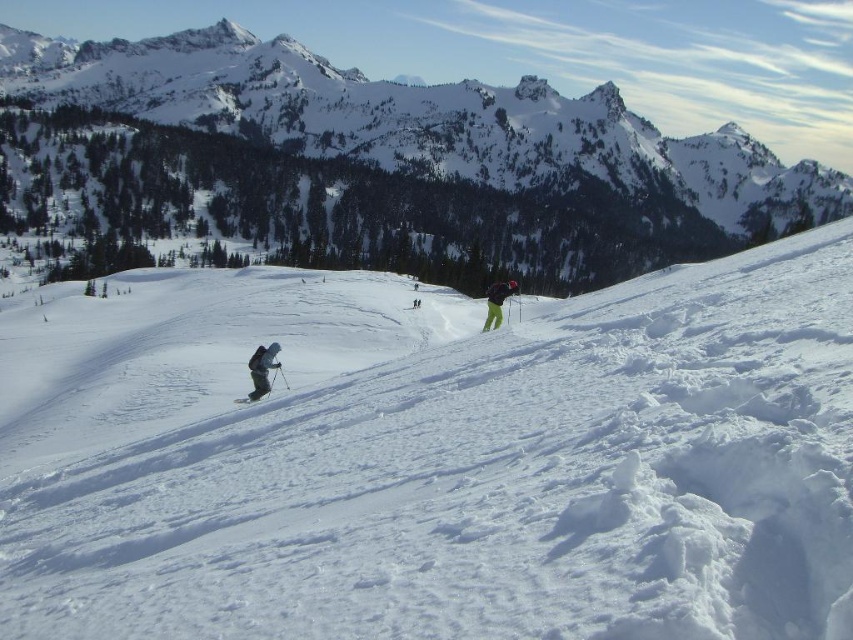
You are a photographer standing at the bottom of the slope. You want to take a photo that includes both the snowy mountain at upper center and the dark gray ski suit at lower left. Which object should you focus on first to ensure both are in clear view?

You should focus on the snowy mountain at upper center first because it is closer to you than the dark gray ski suit at lower left, so focusing on the closer object first will help ensure both are in clear view.

You are a skier planning to descend the slope. You see the white powdery snow at center. Based on its position, which direction should you aim to reach it?

The white powdery snow at center is located at coordinates point (433, 458), so you should aim towards the lower right direction to reach it.